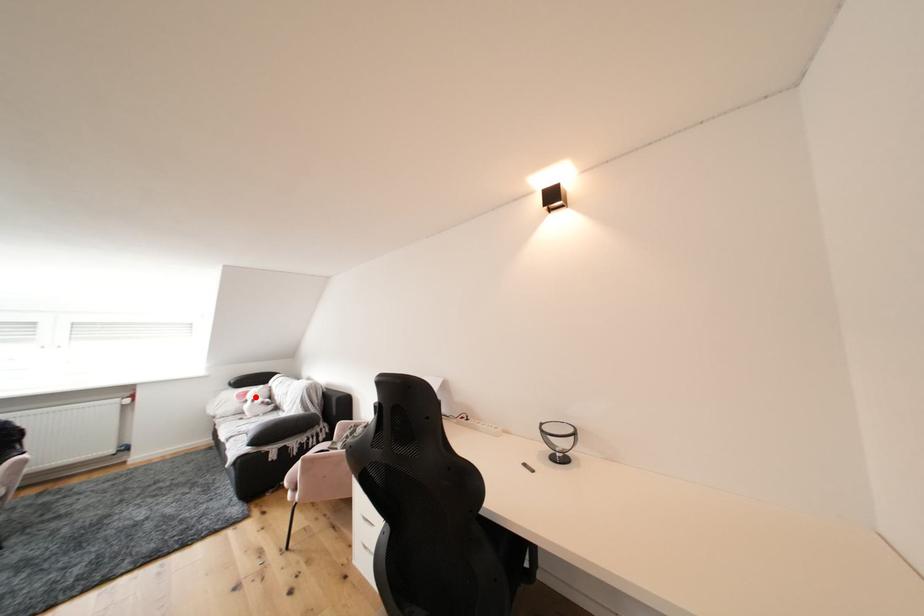
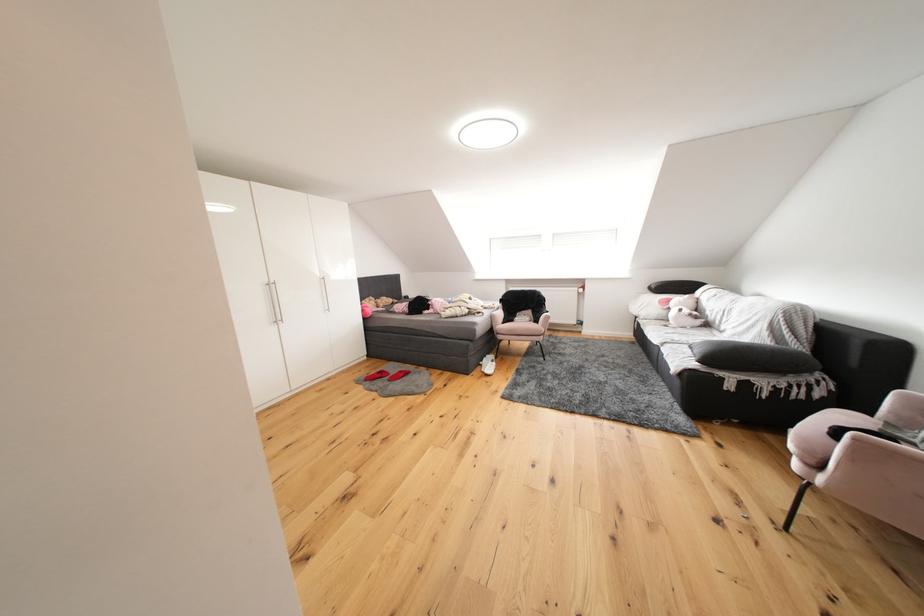
Question: I am providing you with two images of the same scene from different viewpoints. In image1, a red point is highlighted. Considering the same 3D point in image2, which of the following is correct?

Choices:
 (A) It is closer
 (B) It is farther

Answer: (A)